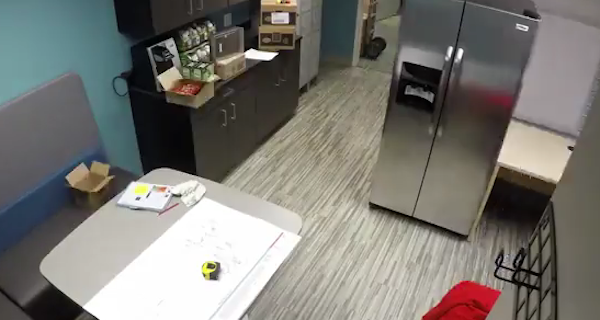
Find the location of a particular element. stainless steel refrigerator is located at coordinates (471, 103), (406, 132).